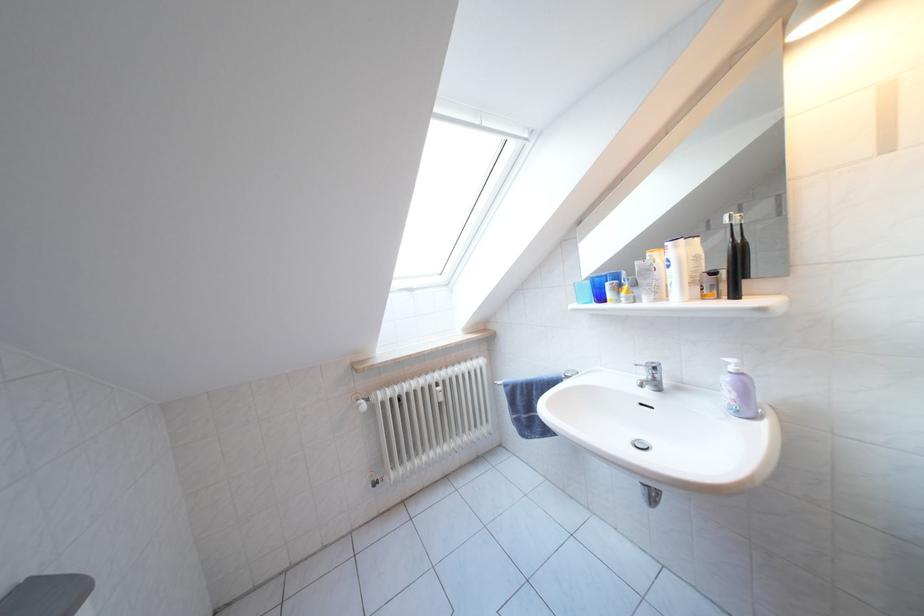
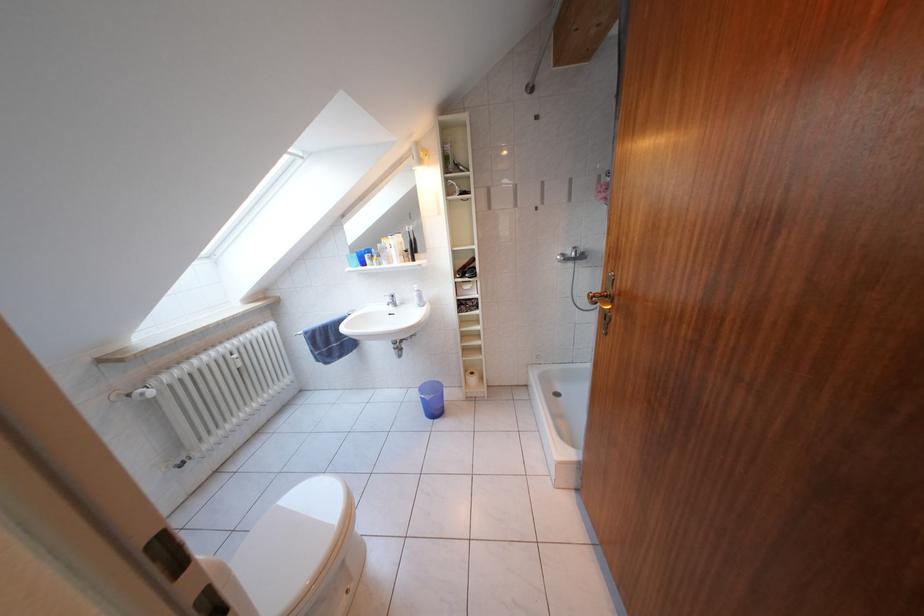
Question: The camera is either moving clockwise (left) or counter-clockwise (right) around the object. The first image is from the beginning of the video and the second image is from the end. Is the camera moving left or right when shooting the video?

Choices:
 (A) Left
 (B) Right

Answer: (A)